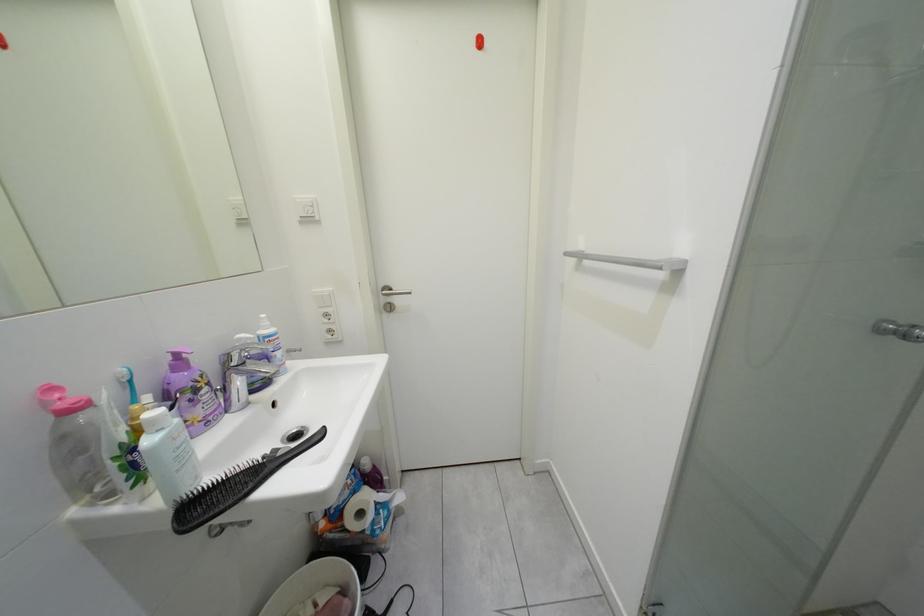
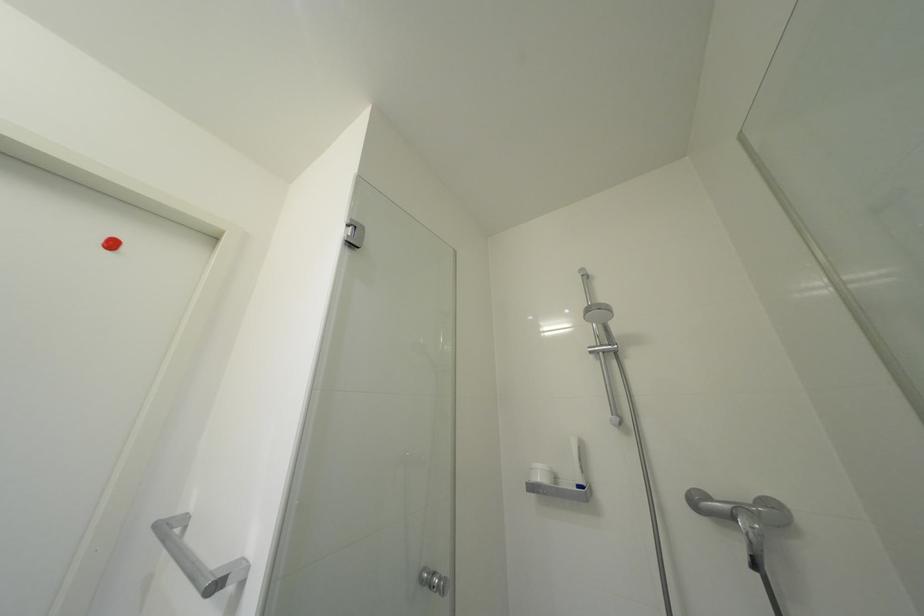
How did the camera likely rotate?

The camera rotated toward right-up.